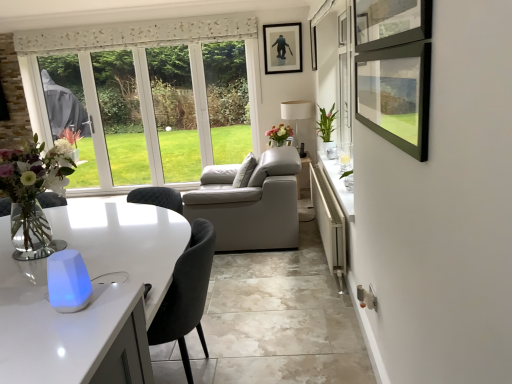
Question: Is translucent glass vase at center, which appears as the first flower when viewed from the left, outside white matte lamp at center?

Choices:
 (A) yes
 (B) no

Answer: (A)

Question: Is translucent glass vase at center, which ranks as the first flower in back-to-front order, shorter than white matte lamp at center?

Choices:
 (A) yes
 (B) no

Answer: (A)

Question: Is translucent glass vase at center, which ranks as the first flower in back-to-front order, positioned in front of white matte lamp at center?

Choices:
 (A) no
 (B) yes

Answer: (B)

Question: Can you confirm if translucent glass vase at center, which appears as the first flower when viewed from the left, is positioned to the left of white matte lamp at center?

Choices:
 (A) yes
 (B) no

Answer: (A)

Question: Is translucent glass vase at center, which appears as the first flower when viewed from the left, positioned with its back to white matte lamp at center?

Choices:
 (A) yes
 (B) no

Answer: (B)

Question: From a real-world perspective, relative to matte black picture frame at upper center, is green glossy vase at upper right, the 2th flower in the back-to-front sequence, vertically above or below?

Choices:
 (A) below
 (B) above

Answer: (A)

Question: From the image's perspective, is green glossy vase at upper right, the second flower positioned from the left, above or below matte black picture frame at upper center?

Choices:
 (A) below
 (B) above

Answer: (A)

Question: Is green glossy vase at upper right, the second flower positioned from the left, taller or shorter than matte black picture frame at upper center?

Choices:
 (A) short
 (B) tall

Answer: (A)

Question: Choose the correct answer: Is green glossy vase at upper right, the 2th flower in the back-to-front sequence, inside matte black picture frame at upper center or outside it?

Choices:
 (A) inside
 (B) outside

Answer: (B)

Question: Is white glossy counter at lower right in front of or behind translucent glass vase at left in the image?

Choices:
 (A) front
 (B) behind

Answer: (B)

Question: From the image's perspective, is white glossy counter at lower right located above or below translucent glass vase at left?

Choices:
 (A) below
 (B) above

Answer: (A)

Question: Does point (340, 254) appear closer or farther from the camera than point (40, 218)?

Choices:
 (A) farther
 (B) closer

Answer: (A)

Question: Is white glossy counter at lower right wider or thinner than translucent glass vase at left?

Choices:
 (A) thin
 (B) wide

Answer: (A)

Question: Is translucent glass vase at center, which appears as the first flower when viewed from the left, wider or thinner than white glossy counter at lower right?

Choices:
 (A) wide
 (B) thin

Answer: (A)

Question: Is point (290, 127) closer or farther from the camera than point (331, 213)?

Choices:
 (A) closer
 (B) farther

Answer: (B)